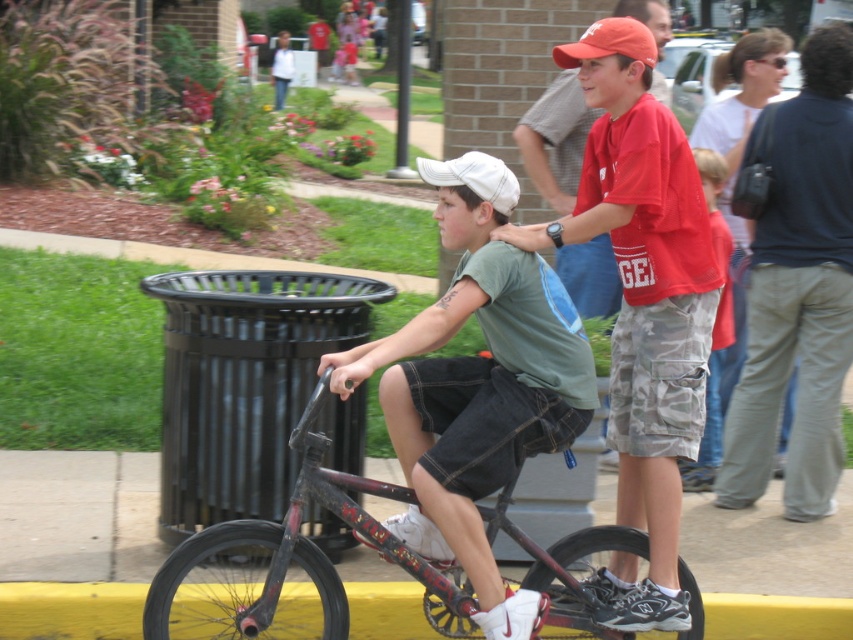
Can you confirm if yellow rubber curb at lower center is positioned to the right of red cotton shirt at upper right?

Correct, you'll find yellow rubber curb at lower center to the right of red cotton shirt at upper right.

Who is more distant from viewer, [752,637] or [569,282]?

The point [569,282] is more distant.

At what (x,y) coordinates should I click in order to perform the action: click on yellow rubber curb at lower center. Please return your answer as a coordinate pair (x, y). The width and height of the screenshot is (853, 640). Looking at the image, I should click on (70, 611).

Is red cotton shirt at upper right positioned behind camouflage shorts at center?

No, red cotton shirt at upper right is closer to the viewer.

Is point (578, 88) positioned behind point (714, 349)?

Yes, it is.

I want to click on red cotton shirt at upper right, so click(555, 140).

Does red cotton shirt at center have a greater height compared to orange matte baseball cap at upper center?

Indeed, red cotton shirt at center has a greater height compared to orange matte baseball cap at upper center.

Which is in front, point (648, 506) or point (572, 45)?

Point (648, 506) is more forward.

Between point (647, 522) and point (585, 56), which one is positioned in front?

Point (585, 56) is in front.

Locate an element on the screen. Image resolution: width=853 pixels, height=640 pixels. red cotton shirt at center is located at coordinates (643, 321).